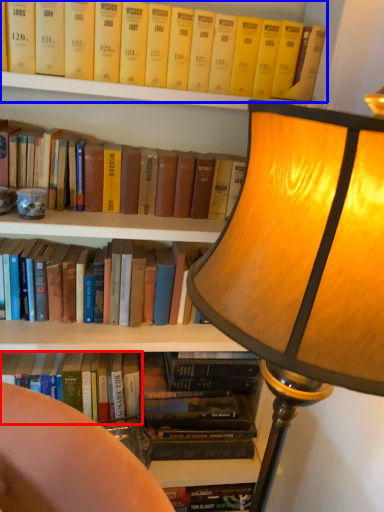
Question: Which of the following is the farthest to the observer, book (highlighted by a red box) or book (highlighted by a blue box)?

Choices:
 (A) book
 (B) book

Answer: (A)